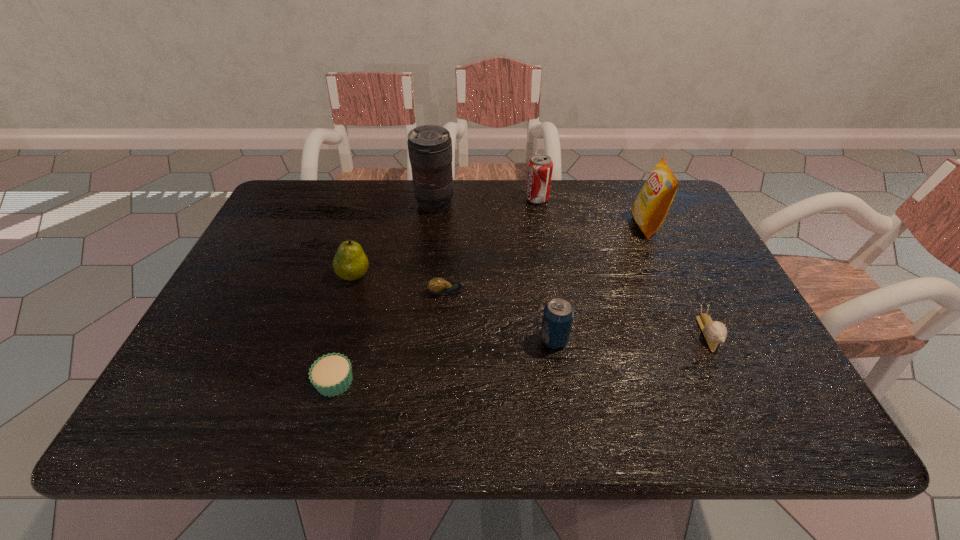
The width and height of the screenshot is (960, 540). I want to click on free space at the far left corner of the desktop, so click(x=267, y=221).

The height and width of the screenshot is (540, 960). In order to click on free space at the near left corner of the desktop in this screenshot , I will do `click(232, 427)`.

Where is `free space at the far right corner of the desktop`? The width and height of the screenshot is (960, 540). free space at the far right corner of the desktop is located at coordinates (690, 224).

Find the location of a particular element. The height and width of the screenshot is (540, 960). vacant space in between the second tallest object and the cupcake is located at coordinates (491, 303).

Identify the location of free space between the cupcake and the shorter pop soda. (444, 360).

Locate an element on the screen. The image size is (960, 540). free spot between the pear and the farther escargot is located at coordinates (401, 284).

Where is `vacant space that is in between the pear and the seventh shortest object`? This screenshot has height=540, width=960. vacant space that is in between the pear and the seventh shortest object is located at coordinates (500, 250).

At what (x,y) coordinates should I click in order to perform the action: click on vacant space that is in between the left escargot and the nearer escargot. Please return your answer as a coordinate pair (x, y). Looking at the image, I should click on (579, 312).

Locate an element on the screen. vacant point located between the left escargot and the crisp (potato chip) is located at coordinates (547, 259).

The width and height of the screenshot is (960, 540). Find the location of `free area in between the right escargot and the cupcake`. free area in between the right escargot and the cupcake is located at coordinates (521, 357).